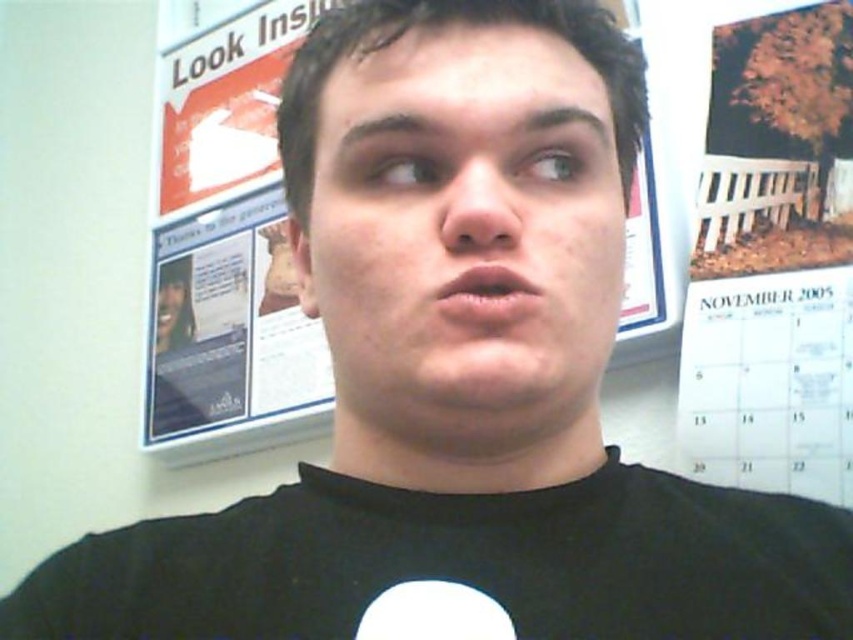
Question: Is smooth skin face at center thinner than black matte t-shirt at center?

Choices:
 (A) yes
 (B) no

Answer: (A)

Question: From the image, what is the correct spatial relationship of smooth skin face at center in relation to black matte t-shirt at center?

Choices:
 (A) left
 (B) right

Answer: (A)

Question: Which point is closer to the camera taking this photo?

Choices:
 (A) (445, 552)
 (B) (531, 401)

Answer: (B)

Question: Which point is closer to the camera?

Choices:
 (A) (584, 298)
 (B) (244, 500)

Answer: (A)

Question: Which point is closer to the camera?

Choices:
 (A) (837, 611)
 (B) (483, 307)

Answer: (B)

Question: Does smooth skin face at center appear under black matte t-shirt at center?

Choices:
 (A) no
 (B) yes

Answer: (A)